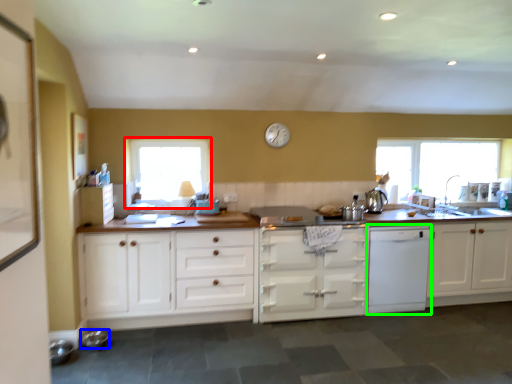
Question: Considering the real-world distances, which object is closest to window (highlighted by a red box)? appliance (highlighted by a blue box) or kitchen appliance (highlighted by a green box).

Choices:
 (A) appliance
 (B) kitchen appliance

Answer: (A)